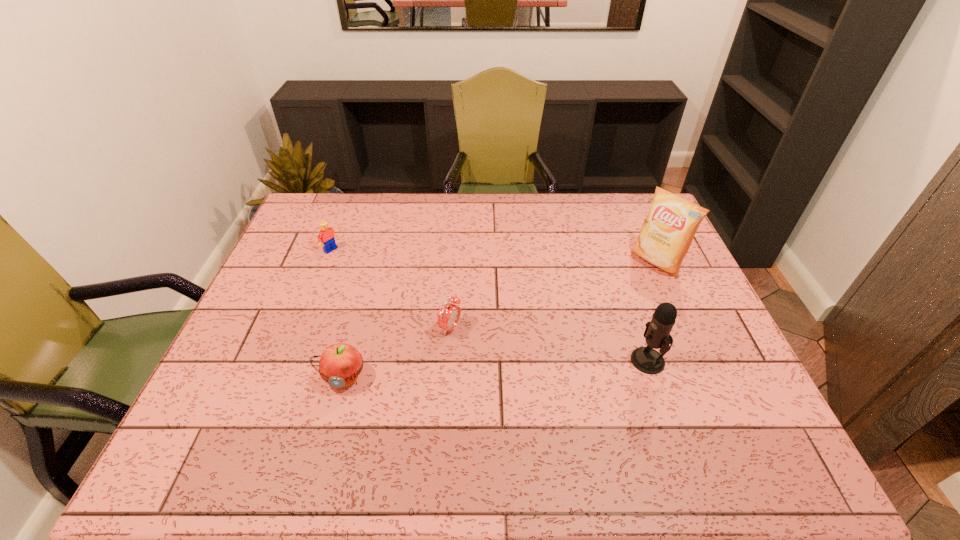
Locate an element on the screen. blank space at the far edge is located at coordinates (564, 193).

Find the location of `vacant space at the near edge of the desktop`. vacant space at the near edge of the desktop is located at coordinates 440,406.

This screenshot has height=540, width=960. Find the location of `blank space at the left edge`. blank space at the left edge is located at coordinates (265, 341).

Where is `free space at the right edge of the desktop`? This screenshot has height=540, width=960. free space at the right edge of the desktop is located at coordinates (657, 282).

Where is `vacant space at the far left corner`? vacant space at the far left corner is located at coordinates (346, 204).

In the image, there is a desktop. Identify the location of vacant space at the near left corner. This screenshot has width=960, height=540. (269, 401).

Where is `free area in between the Lego and the fourth object from right to left`? Image resolution: width=960 pixels, height=540 pixels. free area in between the Lego and the fourth object from right to left is located at coordinates (337, 313).

The image size is (960, 540). I want to click on vacant space that's between the fourth object from right to left and the rightmost object, so click(500, 319).

Identify the location of empty space between the third object from left to right and the leftmost object. The image size is (960, 540). (391, 289).

Find the location of a particular element. vacant space that is in between the rightmost object and the second object from right to left is located at coordinates (653, 311).